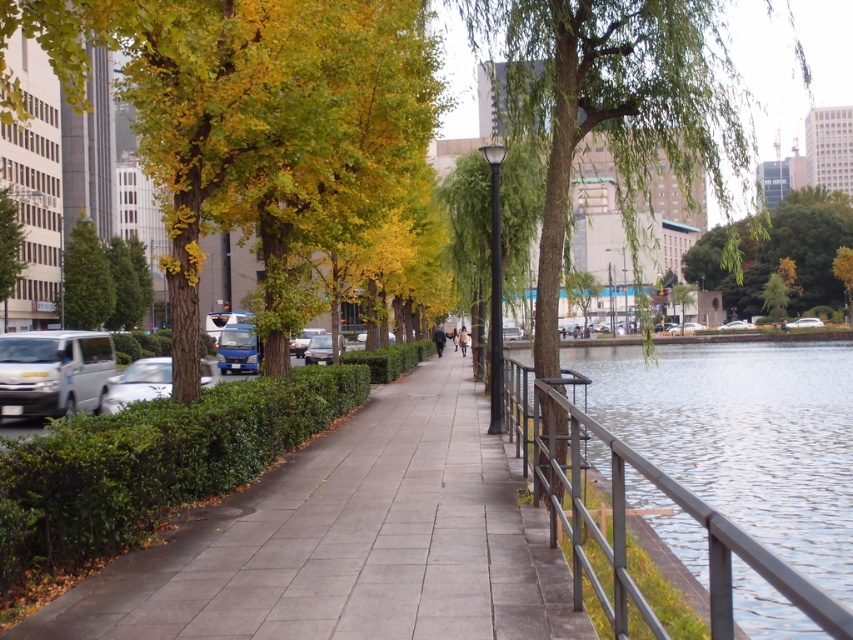
From the picture: You are standing at the point closer to the camera in the image. Which point are you at, point (318, 356) or point (787, 323)?

You are at point (318, 356) because it is in front of point (787, 323), which means it is closer to the camera.